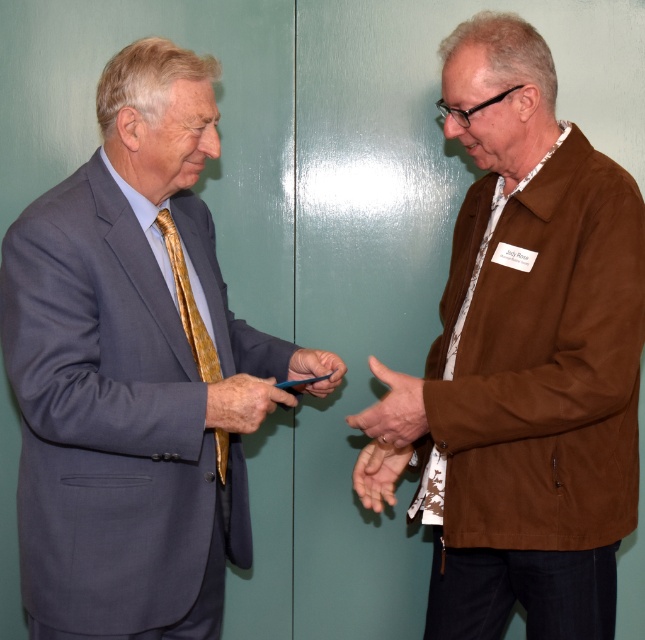
Is brown suede jacket at right closer to the viewer compared to gold textured tie at left?

That is True.

Does point (602, 260) come farther from viewer compared to point (210, 376)?

No, it is in front of (210, 376).

Where is `brown suede jacket at right`? The width and height of the screenshot is (645, 640). brown suede jacket at right is located at coordinates (530, 356).

Based on the photo, is brown suede jacket at right further to camera compared to brown textured tie at right?

No, brown suede jacket at right is in front of brown textured tie at right.

Who is shorter, brown suede jacket at right or brown textured tie at right?

brown textured tie at right is shorter.

Does point (635, 499) lie behind point (495, 216)?

No, (635, 499) is in front of (495, 216).

Where is `brown suede jacket at right`? The width and height of the screenshot is (645, 640). brown suede jacket at right is located at coordinates (530, 356).

Can you confirm if matte gray suit at left is wider than smooth skin hand at center?

Yes, matte gray suit at left is wider than smooth skin hand at center.

In the scene shown: Can you confirm if matte gray suit at left is shorter than smooth skin hand at center?

In fact, matte gray suit at left may be taller than smooth skin hand at center.

Find the location of `matte gray suit at left`. matte gray suit at left is located at coordinates (129, 369).

At what (x,y) coordinates should I click in order to perform the action: click on matte gray suit at left. Please return your answer as a coordinate pair (x, y). The height and width of the screenshot is (640, 645). Looking at the image, I should click on (129, 369).